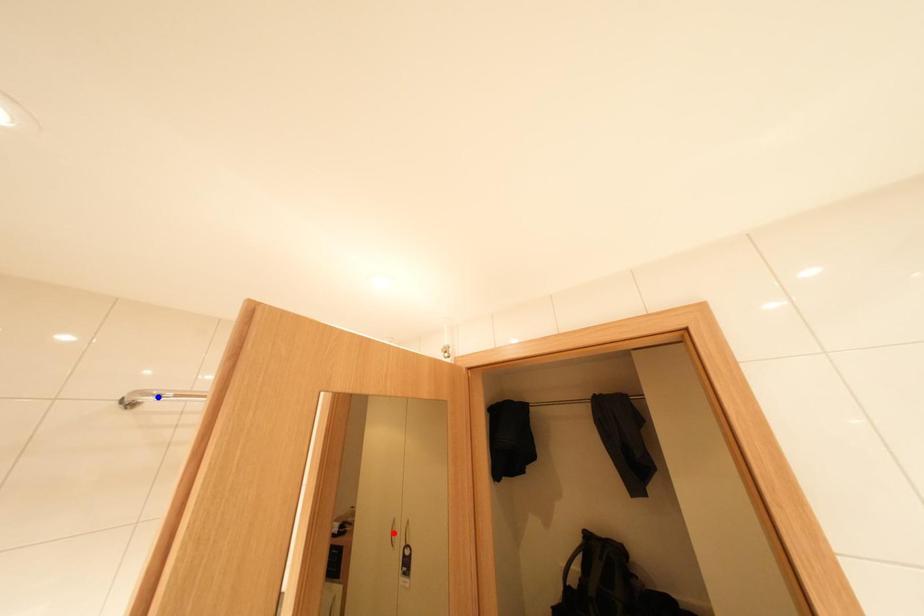
Question: In the image, two points are highlighted. Which point is nearer to the camera? Reply with the corresponding letter.

Choices:
 (A) blue point
 (B) red point

Answer: (A)